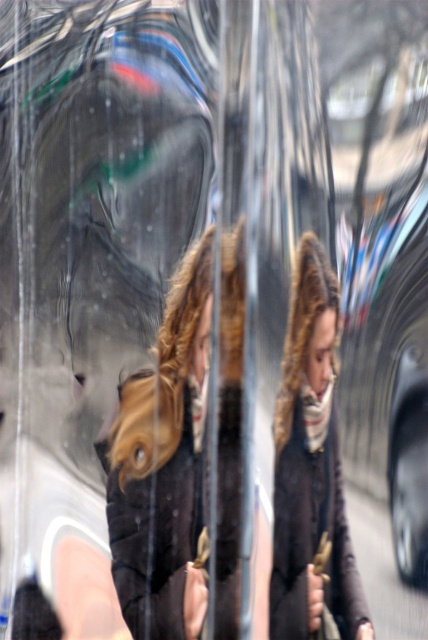
Question: Is dark brown leather jacket at center to the right of dark brown wool coat at center from the viewer's perspective?

Choices:
 (A) no
 (B) yes

Answer: (A)

Question: Which point is closer to the camera?

Choices:
 (A) (327, 364)
 (B) (181, 509)

Answer: (A)

Question: Does dark brown leather jacket at center have a lesser width compared to dark brown wool coat at center?

Choices:
 (A) yes
 (B) no

Answer: (B)

Question: Observing the image, what is the correct spatial positioning of dark brown leather jacket at center in reference to dark brown wool coat at center?

Choices:
 (A) below
 (B) above

Answer: (A)